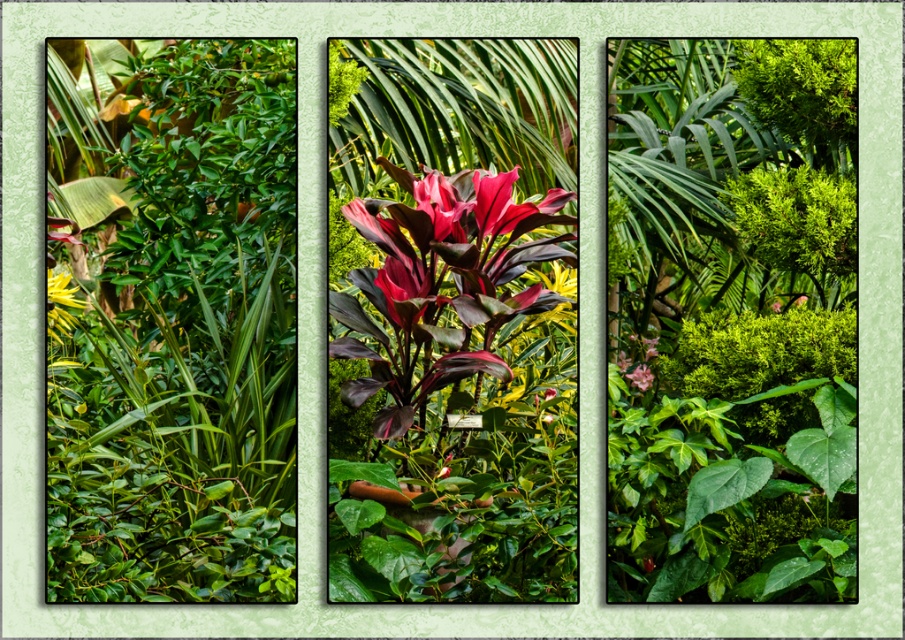
Between green matte leafy bush at left and green glossy flower at lower left, which one is positioned lower?

Positioned lower is green glossy flower at lower left.

Is green matte leafy bush at left above green glossy flower at lower left?

Indeed, green matte leafy bush at left is positioned over green glossy flower at lower left.

Find the location of a particular element. Image resolution: width=905 pixels, height=640 pixels. green matte leafy bush at left is located at coordinates (172, 321).

Who is taller, green leafy bush at center or green glossy flower at lower left?

Standing taller between the two is green leafy bush at center.

In the scene shown: Which is more to the right, green leafy bush at center or green glossy flower at lower left?

green leafy bush at center

You are a GUI agent. You are given a task and a screenshot of the screen. Output one action in this format:
    pyautogui.click(x=<x>, y=<y>)
    Task: Click on the green leafy bush at center
    
    Given the screenshot: What is the action you would take?
    pyautogui.click(x=732, y=320)

Identify the location of green leafy bush at center. This screenshot has width=905, height=640. (732, 320).

Does green glossy flower at lower left appear on the left side of pink matte flower at center?

Yes, green glossy flower at lower left is to the left of pink matte flower at center.

Does point (48, 310) lie behind point (641, 365)?

Yes, it is behind point (641, 365).

Identify the location of green glossy flower at lower left. (62, 305).